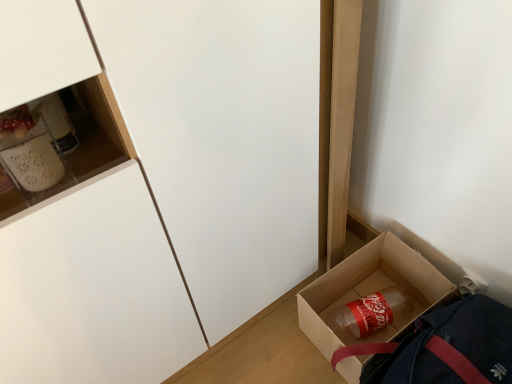
Question: Would you say translucent plastic bottle at lower right is part of brown cardboard box at lower right's contents?

Choices:
 (A) yes
 (B) no

Answer: (A)

Question: From a real-world perspective, is brown cardboard box at lower right below translucent plastic bottle at lower right?

Choices:
 (A) no
 (B) yes

Answer: (A)

Question: From a real-world perspective, is brown cardboard box at lower right physically above translucent plastic bottle at lower right?

Choices:
 (A) yes
 (B) no

Answer: (A)

Question: Can you confirm if brown cardboard box at lower right is wider than translucent plastic bottle at lower right?

Choices:
 (A) yes
 (B) no

Answer: (A)

Question: Does brown cardboard box at lower right have a lesser width compared to translucent plastic bottle at lower right?

Choices:
 (A) no
 (B) yes

Answer: (A)

Question: From a real-world perspective, is brown cardboard box at lower right above or below matte white cabinet at lower left?

Choices:
 (A) below
 (B) above

Answer: (A)

Question: Would you say brown cardboard box at lower right is inside or outside matte white cabinet at lower left?

Choices:
 (A) outside
 (B) inside

Answer: (A)

Question: Is point (399, 253) positioned closer to the camera than point (257, 158)?

Choices:
 (A) farther
 (B) closer

Answer: (A)

Question: From the image's perspective, relative to matte white cabinet at lower left, is brown cardboard box at lower right above or below?

Choices:
 (A) below
 (B) above

Answer: (A)

Question: Is translucent plastic bottle at lower right inside the boundaries of matte white cabinet at lower left, or outside?

Choices:
 (A) inside
 (B) outside

Answer: (B)

Question: Would you say translucent plastic bottle at lower right is to the left or to the right of matte white cabinet at lower left in the picture?

Choices:
 (A) right
 (B) left

Answer: (A)

Question: Based on their sizes in the image, would you say translucent plastic bottle at lower right is bigger or smaller than matte white cabinet at lower left?

Choices:
 (A) small
 (B) big

Answer: (A)

Question: From a real-world perspective, relative to matte white cabinet at lower left, is translucent plastic bottle at lower right vertically above or below?

Choices:
 (A) below
 (B) above

Answer: (A)

Question: From the image's perspective, is matte white cabinet at lower left located above or below translucent plastic bottle at lower right?

Choices:
 (A) below
 (B) above

Answer: (B)

Question: Considering the positions of matte white cabinet at lower left and translucent plastic bottle at lower right in the image, is matte white cabinet at lower left wider or thinner than translucent plastic bottle at lower right?

Choices:
 (A) thin
 (B) wide

Answer: (B)